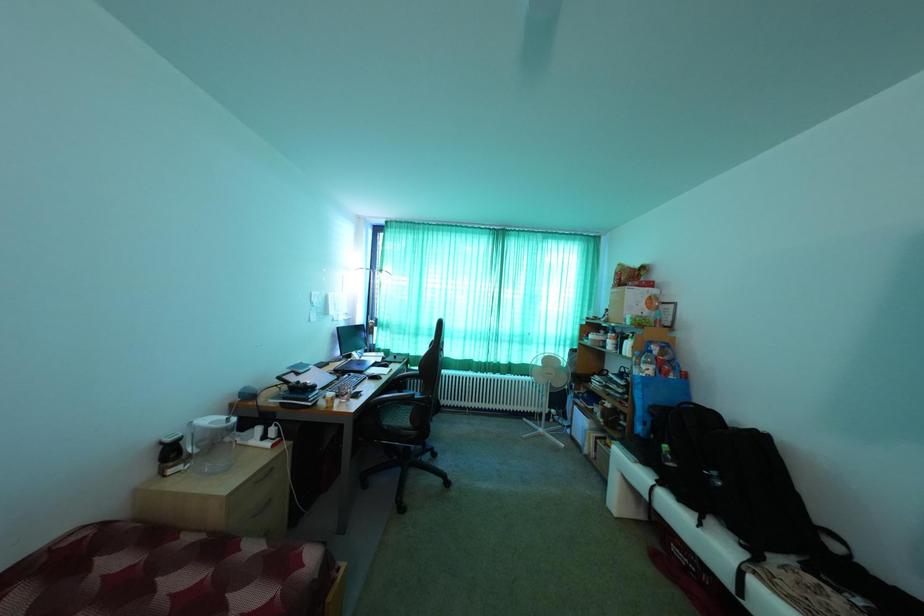
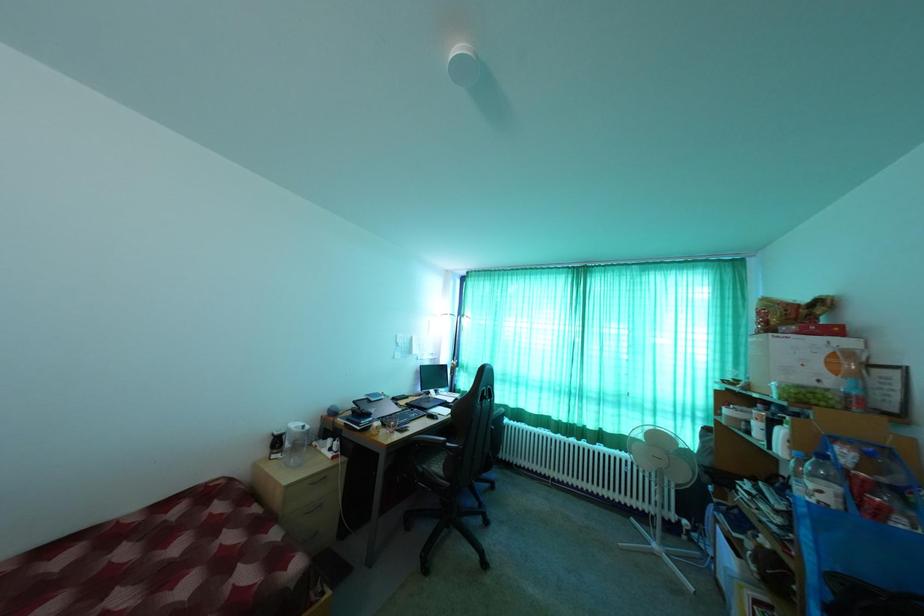
Question: The camera is either moving clockwise (left) or counter-clockwise (right) around the object. The first image is from the beginning of the video and the second image is from the end. Is the camera moving left or right when shooting the video?

Choices:
 (A) Left
 (B) Right

Answer: (B)